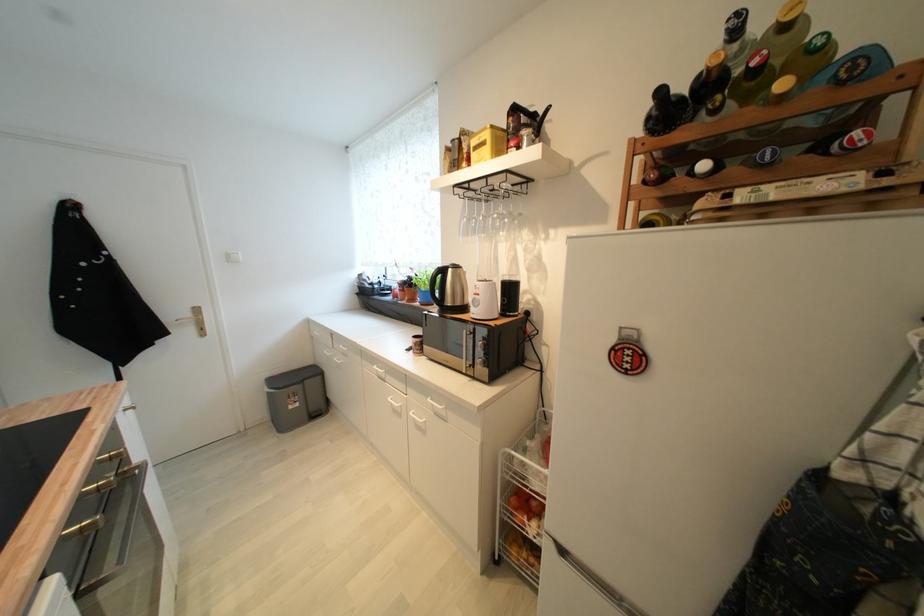
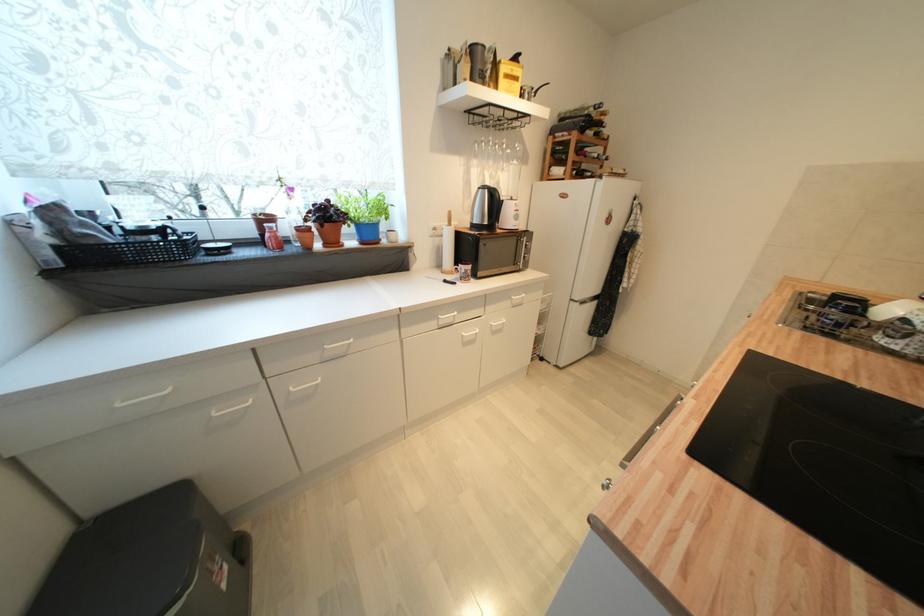
In the second image, find the point that corresponds to [296,408] in the first image.

(228, 588)